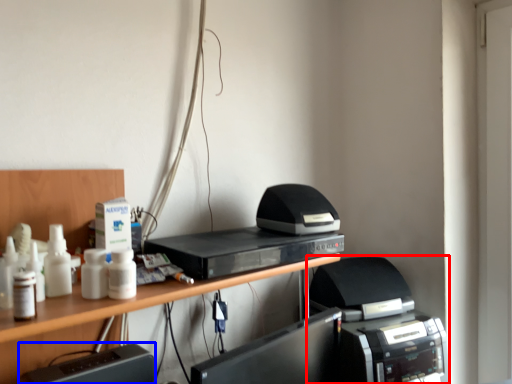
Question: Which object appears farthest to the camera in this image, printer (highlighted by a red box) or register (highlighted by a blue box)?

Choices:
 (A) printer
 (B) register

Answer: (A)